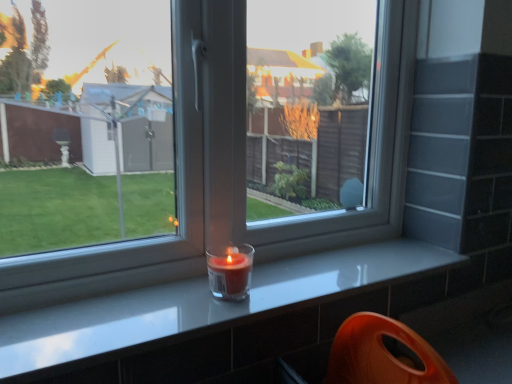
Locate an element on the screen. This screenshot has height=384, width=512. free space to the back side of translucent glass candle at window is located at coordinates (265, 266).